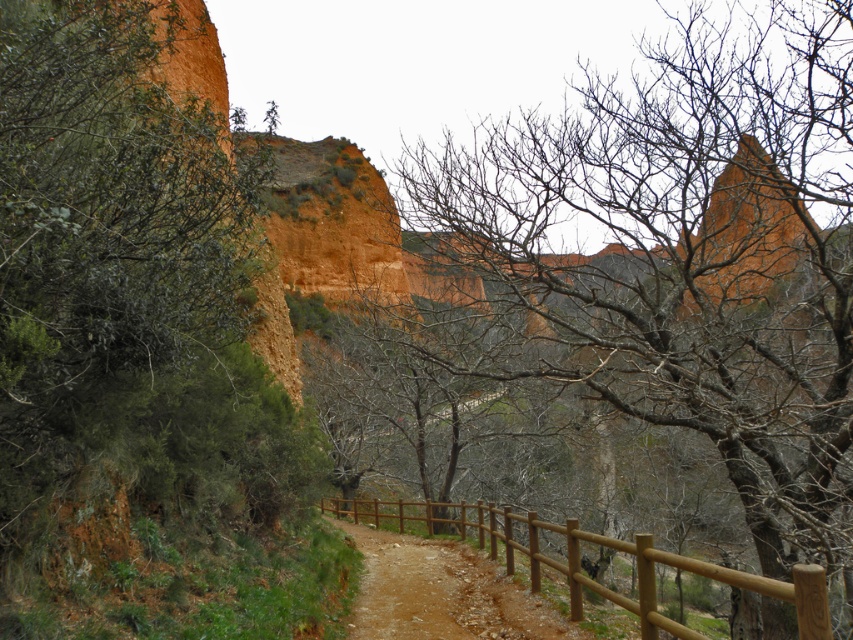
Who is positioned more to the right, bare branches at center or brown wooden fence at lower center?

bare branches at center

Which is behind, point (585, 74) or point (653, 586)?

Positioned behind is point (585, 74).

Who is more forward, (543, 236) or (577, 612)?

Positioned in front is point (577, 612).

At what (x,y) coordinates should I click in order to perform the action: click on bare branches at center. Please return your answer as a coordinate pair (x, y). The height and width of the screenshot is (640, 853). Looking at the image, I should click on (682, 253).